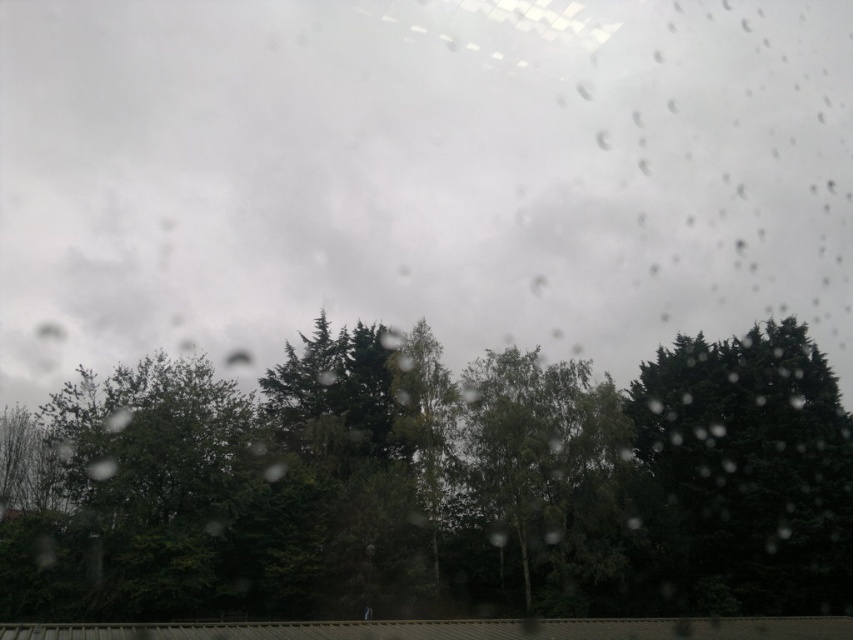
Question: Which object appears closest to the camera in this image?

Choices:
 (A) green matte tree at center
 (B) dark green leafy tree at right

Answer: (A)

Question: Is green matte tree at center in front of dark green leafy tree at right?

Choices:
 (A) yes
 (B) no

Answer: (A)

Question: Which object is farther from the camera taking this photo?

Choices:
 (A) green matte tree at center
 (B) green leafy tree at center
 (C) dark green leafy tree at right

Answer: (B)

Question: Is green matte tree at center below dark green leafy tree at right?

Choices:
 (A) no
 (B) yes

Answer: (A)

Question: Which point is closer to the camera?

Choices:
 (A) green matte tree at center
 (B) green leafy tree at center
 (C) dark green leafy tree at right

Answer: (A)

Question: Is green matte tree at center thinner than green leafy tree at center?

Choices:
 (A) no
 (B) yes

Answer: (A)